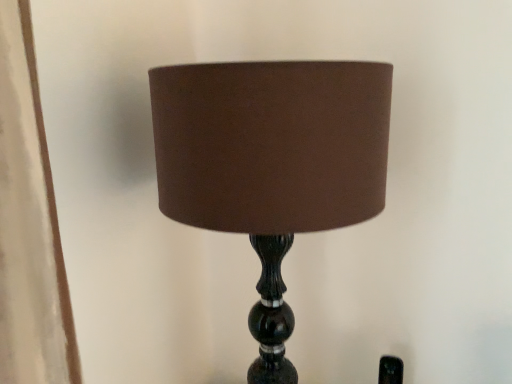
This screenshot has height=384, width=512. Describe the element at coordinates (271, 164) in the screenshot. I see `brown fabric lampshade at center` at that location.

Locate an element on the screen. The height and width of the screenshot is (384, 512). brown fabric lampshade at center is located at coordinates (271, 164).

Locate an element on the screen. brown fabric lampshade at center is located at coordinates (271, 164).